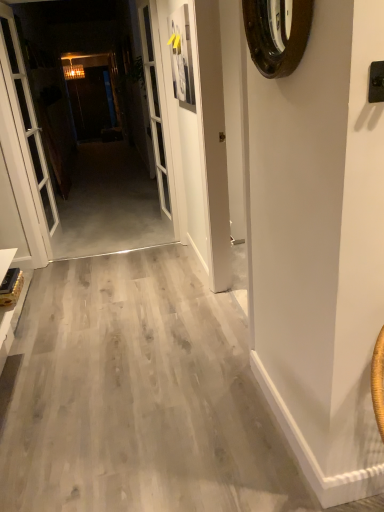
Question: From the image's perspective, does white glass screen door at center appear higher than brown wooden clock at upper right?

Choices:
 (A) yes
 (B) no

Answer: (A)

Question: Would you consider white glass screen door at center to be distant from brown wooden clock at upper right?

Choices:
 (A) no
 (B) yes

Answer: (B)

Question: From a real-world perspective, does white glass screen door at center sit lower than brown wooden clock at upper right?

Choices:
 (A) yes
 (B) no

Answer: (A)

Question: Is brown wooden clock at upper right a part of white glass screen door at center?

Choices:
 (A) yes
 (B) no

Answer: (B)

Question: From a real-world perspective, does white glass screen door at center stand above brown wooden clock at upper right?

Choices:
 (A) yes
 (B) no

Answer: (B)

Question: Looking at their shapes, would you say brown wooden clock at upper right is wider or thinner than white glass screen door at center?

Choices:
 (A) wide
 (B) thin

Answer: (B)

Question: Looking at the image, does brown wooden clock at upper right seem bigger or smaller compared to white glass screen door at center?

Choices:
 (A) big
 (B) small

Answer: (B)

Question: Choose the correct answer: Is brown wooden clock at upper right inside white glass screen door at center or outside it?

Choices:
 (A) outside
 (B) inside

Answer: (A)

Question: Considering the positions of point (258, 40) and point (157, 148), is point (258, 40) closer or farther from the camera than point (157, 148)?

Choices:
 (A) farther
 (B) closer

Answer: (B)

Question: Is concrete floor at center taller or shorter than brown wooden clock at upper right?

Choices:
 (A) short
 (B) tall

Answer: (B)

Question: Is point (107, 39) positioned closer to the camera than point (264, 11)?

Choices:
 (A) closer
 (B) farther

Answer: (B)

Question: Relative to brown wooden clock at upper right, is concrete floor at center in front or behind?

Choices:
 (A) behind
 (B) front

Answer: (A)

Question: Is concrete floor at center bigger or smaller than brown wooden clock at upper right?

Choices:
 (A) small
 (B) big

Answer: (B)

Question: Considering the positions of white glass door at left and brown wooden clock at upper right in the image, is white glass door at left bigger or smaller than brown wooden clock at upper right?

Choices:
 (A) big
 (B) small

Answer: (A)

Question: From the image's perspective, is white glass door at left located above or below brown wooden clock at upper right?

Choices:
 (A) above
 (B) below

Answer: (A)